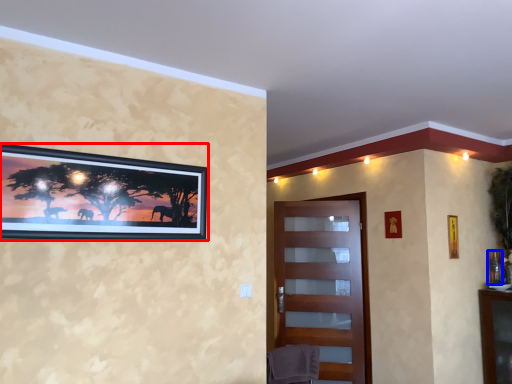
Question: Which point is further to the camera, picture frame (highlighted by a red box) or picture frame (highlighted by a blue box)?

Choices:
 (A) picture frame
 (B) picture frame

Answer: (B)